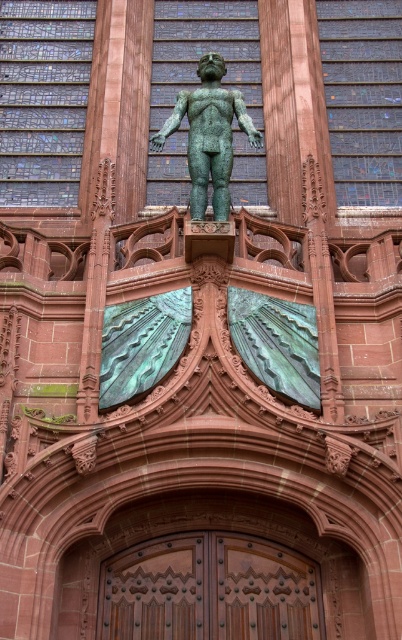
You are standing in the grand structure and want to enter through the doors. Which direction should you walk relative to the green patinated bronze statue at upper center to reach the polished wood doors at center?

You should walk downward towards the polished wood doors at center, which are located below the green patinated bronze statue at upper center.

You are standing in front of the grand architectural structure and want to take a photo. You notice two points marked in the image. Which point, point (278, 628) or point (201, 60), is closer to you?

Point (278, 628) is closer to the camera than point (201, 60), so it is closer to you.